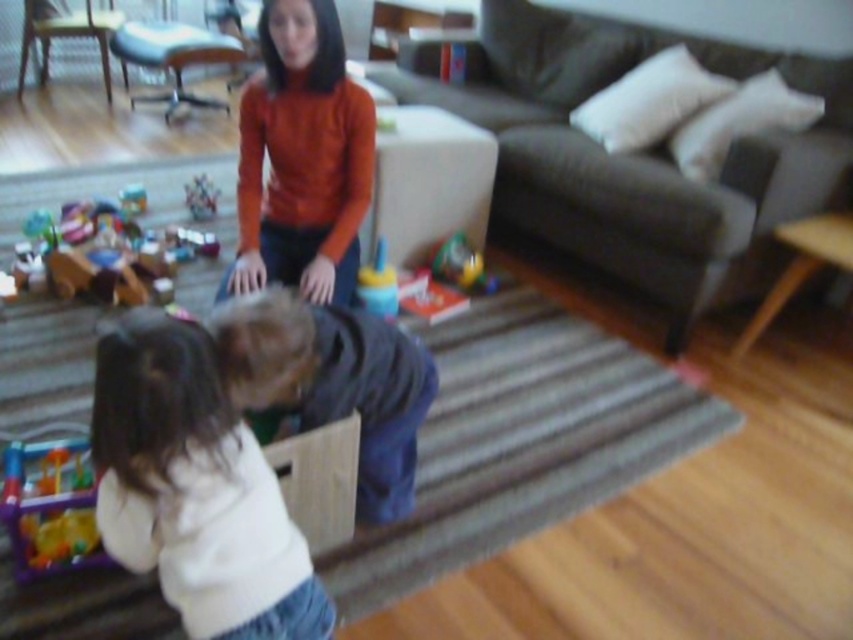
Which of these two, dark blue fabric at center or wooden toy car at lower left, stands shorter?

dark blue fabric at center

Is dark blue fabric at center above wooden toy car at lower left?

No, dark blue fabric at center is not above wooden toy car at lower left.

Is point (397, 445) in front of point (201, 180)?

Yes, it is in front of point (201, 180).

You are a GUI agent. You are given a task and a screenshot of the screen. Output one action in this format:
    pyautogui.click(x=<x>, y=<y>)
    Task: Click on the dark blue fabric at center
    Image resolution: width=853 pixels, height=640 pixels.
    Given the screenshot: What is the action you would take?
    pyautogui.click(x=332, y=381)

Does dark blue fabric at center have a greater width compared to plastic colorful toy at center?

Correct, the width of dark blue fabric at center exceeds that of plastic colorful toy at center.

Is point (433, 371) positioned after point (440, 252)?

No, (433, 371) is closer to viewer.

The image size is (853, 640). Identify the location of dark blue fabric at center. [332, 381].

Based on the photo, does dark gray fabric couch at upper right come behind plastic toy at center?

No.

Does dark gray fabric couch at upper right have a lesser width compared to plastic toy at center?

In fact, dark gray fabric couch at upper right might be wider than plastic toy at center.

Which is in front, point (683, 198) or point (190, 198)?

Point (683, 198)

The image size is (853, 640). Identify the location of dark gray fabric couch at upper right. (634, 156).